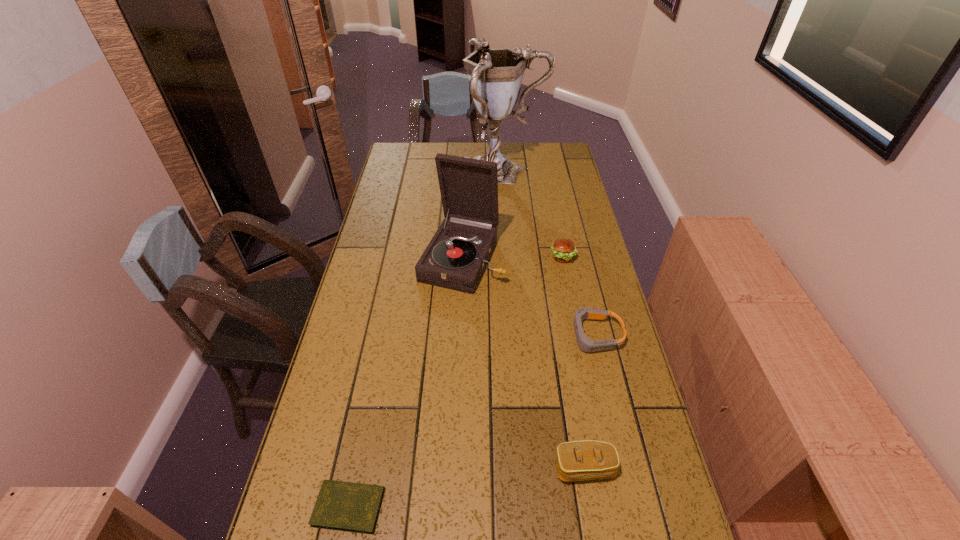
Locate an element on the screen. The image size is (960, 540). free space located on the front of the fifth shortest object is located at coordinates (458, 362).

The width and height of the screenshot is (960, 540). Find the location of `free space located 0.050m on the left of the hamburger`. free space located 0.050m on the left of the hamburger is located at coordinates (536, 258).

Where is `free space located on the front and back of the fifth tallest object`? free space located on the front and back of the fifth tallest object is located at coordinates (543, 335).

The image size is (960, 540). What are the coordinates of `vacant space located on the front and back of the fifth tallest object` in the screenshot? It's located at (530, 335).

Locate an element on the screen. blank space located 0.070m on the front and back of the fifth tallest object is located at coordinates (543, 335).

Where is `vacant space located 0.260m on the right of the shortest object`? The image size is (960, 540). vacant space located 0.260m on the right of the shortest object is located at coordinates (502, 507).

The height and width of the screenshot is (540, 960). I want to click on object located in the far edge section of the desktop, so click(495, 75).

At what (x,y) coordinates should I click in order to perform the action: click on object present at the left edge. Please return your answer as a coordinate pair (x, y). Looking at the image, I should click on (345, 506).

Where is `trophy cup that is at the right edge`? This screenshot has width=960, height=540. trophy cup that is at the right edge is located at coordinates [495, 75].

Find the location of a particular element. This screenshot has height=540, width=960. hamburger located at the right edge is located at coordinates [x=563, y=250].